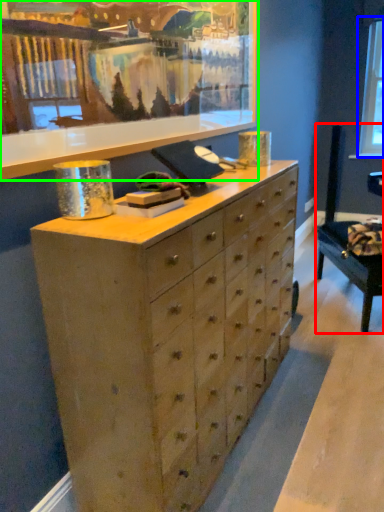
Question: Which object is the farthest from swivel chair (highlighted by a red box)? Choose among these: window screen (highlighted by a blue box) or picture frame (highlighted by a green box).

Choices:
 (A) window screen
 (B) picture frame

Answer: (A)